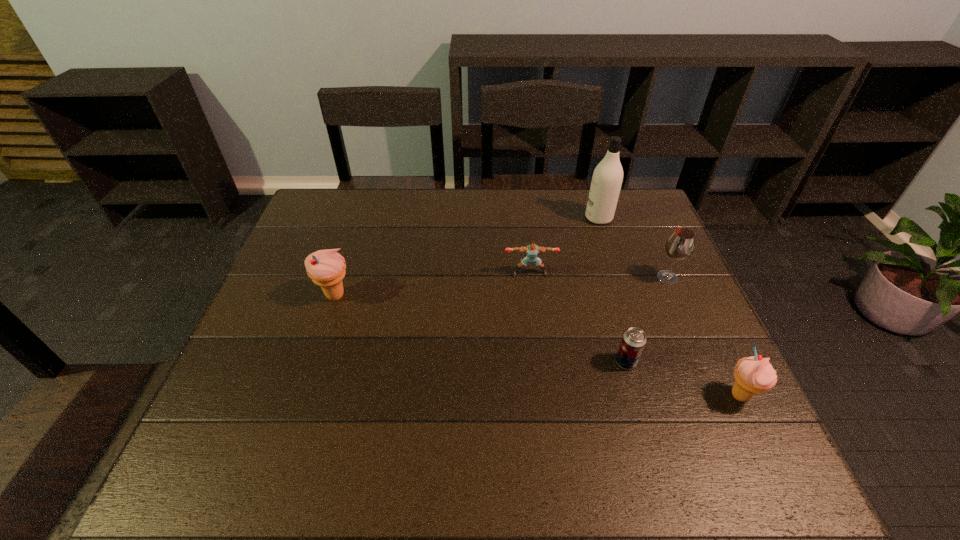
The height and width of the screenshot is (540, 960). I want to click on free area in between the right icecream and the wineglass, so click(704, 336).

Image resolution: width=960 pixels, height=540 pixels. I want to click on free area in between the wineglass and the fifth farthest object, so click(647, 320).

Identify the location of free spot between the shampoo and the puncher. (564, 246).

You are a GUI agent. You are given a task and a screenshot of the screen. Output one action in this format:
    pyautogui.click(x=<x>, y=<y>)
    Task: Click on the free space between the left icecream and the fifth farthest object
    
    Given the screenshot: What is the action you would take?
    pyautogui.click(x=481, y=329)

Find the location of a particular element. vacant area that lies between the beer can and the puncher is located at coordinates (578, 318).

I want to click on free space between the leftmost object and the beer can, so click(x=481, y=329).

You are a GUI agent. You are given a task and a screenshot of the screen. Output one action in this format:
    pyautogui.click(x=<x>, y=<y>)
    Task: Click on the free point between the shampoo and the wineglass
    
    Given the screenshot: What is the action you would take?
    pyautogui.click(x=633, y=248)

The image size is (960, 540). I want to click on free spot between the fifth farthest object and the right icecream, so click(x=683, y=379).

This screenshot has height=540, width=960. In order to click on free area in between the puncher and the second nearest object in this screenshot , I will do `click(578, 318)`.

Where is `object that can be found as the fourth closest to the beer can`? The height and width of the screenshot is (540, 960). object that can be found as the fourth closest to the beer can is located at coordinates (607, 178).